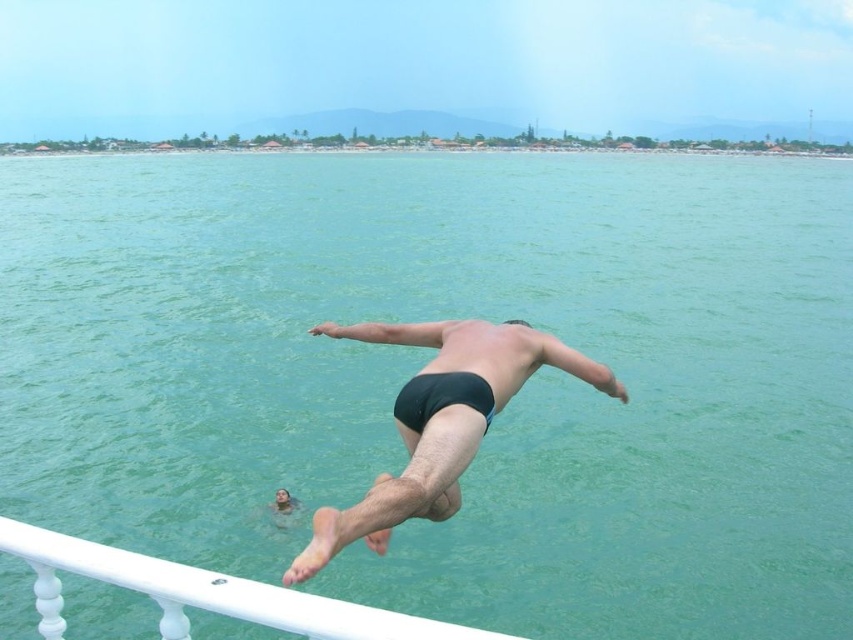
Question: Is the position of black matte swim trunks at center more distant than that of black matte swim trunks at lower center?

Choices:
 (A) no
 (B) yes

Answer: (A)

Question: Which of the following is the closest to the observer?

Choices:
 (A) (283, 513)
 (B) (386, 509)

Answer: (B)

Question: Can you confirm if white glossy rail at lower left is smaller than black matte swim trunks at lower center?

Choices:
 (A) yes
 (B) no

Answer: (B)

Question: Among these objects, which one is nearest to the camera?

Choices:
 (A) black matte swim trunks at lower center
 (B) black matte swim trunks at center

Answer: (B)

Question: Which is farther from the black matte swim trunks at lower center?

Choices:
 (A) white glossy rail at lower left
 (B) black matte swim trunks at center

Answer: (A)

Question: Can you confirm if black matte swim trunks at center is positioned to the right of white glossy rail at lower left?

Choices:
 (A) no
 (B) yes

Answer: (B)